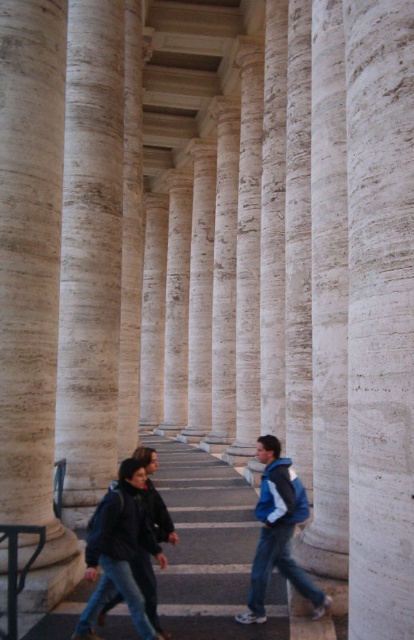
Question: Which point is farther to the camera?

Choices:
 (A) blue fleece jacket at center
 (B) dark blue jacket at center
 (C) black metal balustrade at lower left

Answer: (A)

Question: Which point is closer to the camera taking this photo?

Choices:
 (A) (7, 552)
 (B) (295, 484)
 (C) (91, 632)

Answer: (A)

Question: Is smooth white column at center below blue fleece jacket at center?

Choices:
 (A) yes
 (B) no

Answer: (B)

Question: Is dark blue jacket at center closer to camera compared to black metal balustrade at lower left?

Choices:
 (A) no
 (B) yes

Answer: (A)

Question: Which object is farther from the camera taking this photo?

Choices:
 (A) dark blue jacket at center
 (B) smooth white column at center
 (C) blue fleece jacket at center
 (D) black metal balustrade at lower left

Answer: (C)

Question: Is dark blue jacket at center bigger than black metal balustrade at lower left?

Choices:
 (A) yes
 (B) no

Answer: (B)